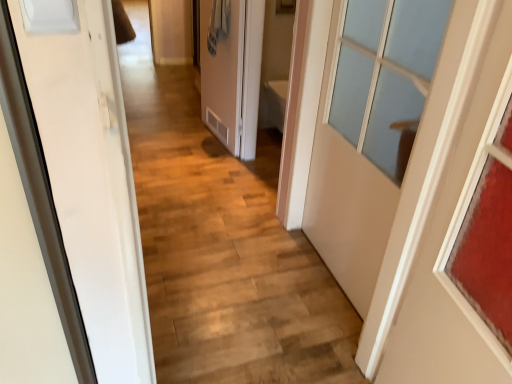
Question: Can you confirm if matte glass door at right, which appears as the 1th door when viewed from the front, is shorter than matte white door at center, the third door from the right?

Choices:
 (A) yes
 (B) no

Answer: (B)

Question: Can you confirm if matte glass door at right, which is the third door in left-to-right order, is bigger than matte white door at center, which is counted as the first door, starting from the back?

Choices:
 (A) no
 (B) yes

Answer: (B)

Question: From a real-world perspective, is matte glass door at right, the 1th door positioned from the right, beneath matte white door at center, the third door from the right?

Choices:
 (A) yes
 (B) no

Answer: (B)

Question: Is matte glass door at right, which is the third door in left-to-right order, positioned beyond the bounds of matte white door at center, which appears as the 1th door when viewed from the left?

Choices:
 (A) yes
 (B) no

Answer: (A)

Question: Does matte glass door at right, which is counted as the 3th door, starting from the back, contain matte white door at center, which is counted as the first door, starting from the back?

Choices:
 (A) yes
 (B) no

Answer: (B)

Question: Considering the positions of white matte door at right, positioned as the second door in back-to-front order, and matte white door at center, placed as the third door when sorted from front to back, in the image, is white matte door at right, positioned as the second door in back-to-front order, wider or thinner than matte white door at center, placed as the third door when sorted from front to back,?

Choices:
 (A) wide
 (B) thin

Answer: (A)

Question: From a real-world perspective, is white matte door at right, the second door from the left, positioned above or below matte white door at center, the third door from the right?

Choices:
 (A) above
 (B) below

Answer: (A)

Question: From the image's perspective, is white matte door at right, positioned as the second door in back-to-front order, above or below matte white door at center, the third door from the right?

Choices:
 (A) below
 (B) above

Answer: (A)

Question: Would you say white matte door at right, which ranks as the second door in right-to-left order, is to the left or to the right of matte white door at center, the third door from the right, in the picture?

Choices:
 (A) left
 (B) right

Answer: (B)

Question: Considering the positions of matte glass door at right, which is the third door in left-to-right order, and white matte door at right, the second door from the left, in the image, is matte glass door at right, which is the third door in left-to-right order, taller or shorter than white matte door at right, the second door from the left,?

Choices:
 (A) tall
 (B) short

Answer: (A)

Question: Would you say matte glass door at right, which is the third door in left-to-right order, is to the left or to the right of white matte door at right, the second door from the left, in the picture?

Choices:
 (A) right
 (B) left

Answer: (A)

Question: From the image's perspective, is matte glass door at right, the 1th door positioned from the right, positioned above or below white matte door at right, positioned as the second door in back-to-front order?

Choices:
 (A) below
 (B) above

Answer: (A)

Question: Is matte glass door at right, which appears as the 1th door when viewed from the front, in front of or behind white matte door at right, which is the second door in front-to-back order, in the image?

Choices:
 (A) front
 (B) behind

Answer: (A)

Question: Considering the positions of point (402, 72) and point (395, 311), is point (402, 72) closer or farther from the camera than point (395, 311)?

Choices:
 (A) closer
 (B) farther

Answer: (B)

Question: Is white matte door at right, positioned as the second door in back-to-front order, inside the boundaries of matte glass door at right, which is counted as the 3th door, starting from the back, or outside?

Choices:
 (A) inside
 (B) outside

Answer: (B)